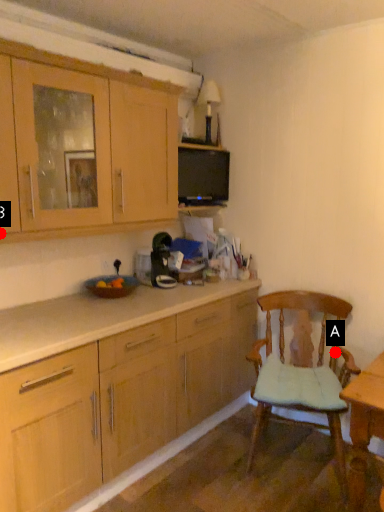
Question: Two points are circled on the image, labeled by A and B beside each circle. Among these points, which one is farthest from the camera?

Choices:
 (A) A is further
 (B) B is further

Answer: (A)